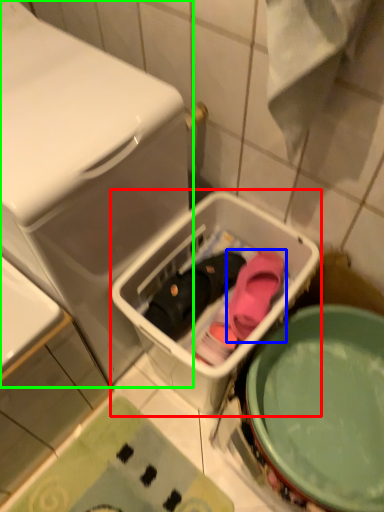
Question: Which is nearer to the dish washer (highlighted by a red box)? footwear (highlighted by a blue box) or dish washer (highlighted by a green box).

Choices:
 (A) footwear
 (B) dish washer

Answer: (A)